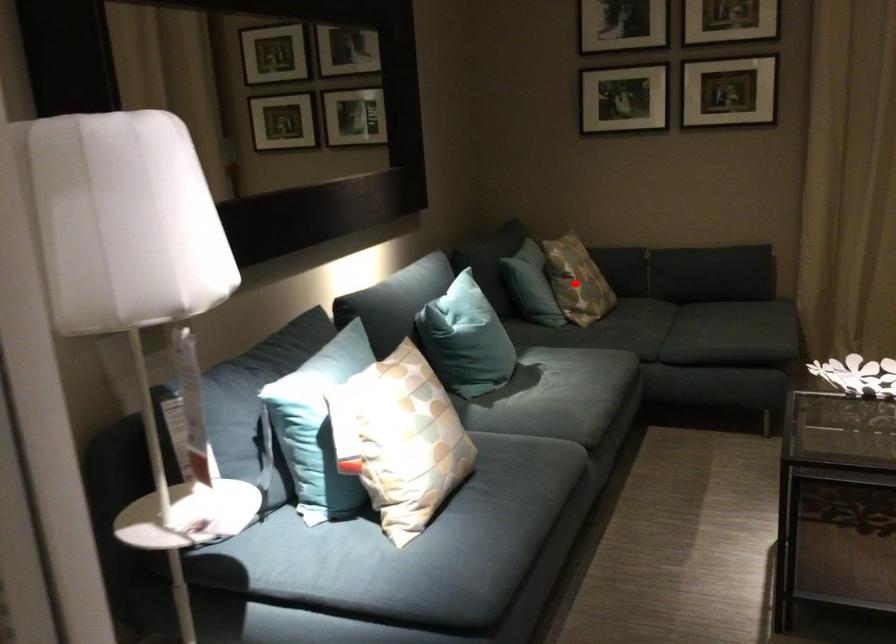
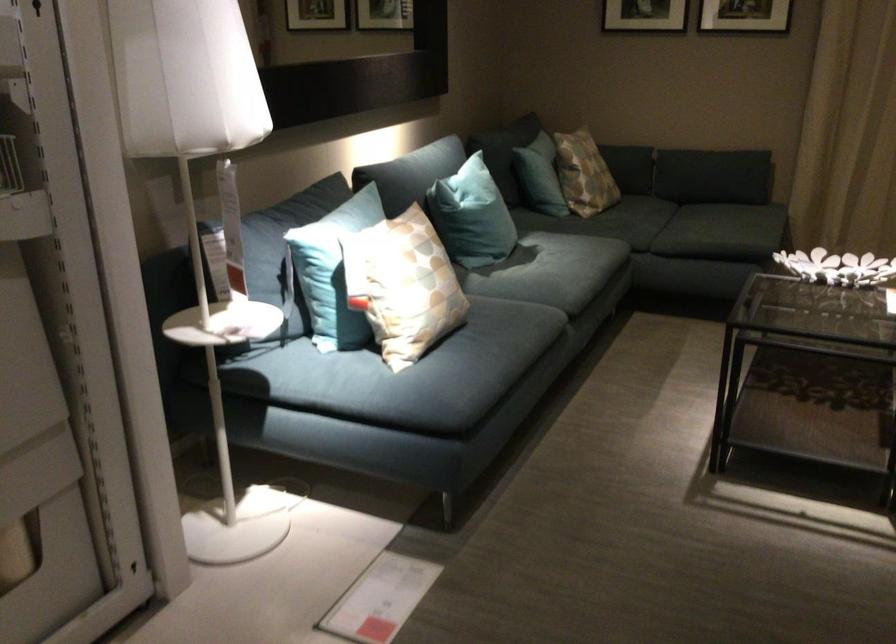
Find the pixel in the second image that matches the highlighted location in the first image.

(583, 174)